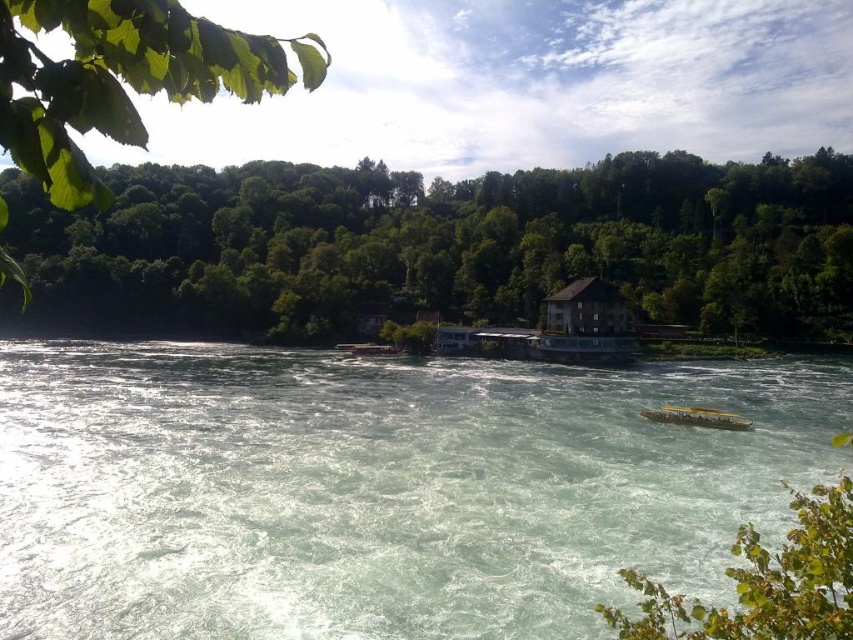
Is white frothy water at center positioned behind green leafy trees at upper center?

No, it is in front of green leafy trees at upper center.

What do you see at coordinates (379, 488) in the screenshot? I see `white frothy water at center` at bounding box center [379, 488].

Image resolution: width=853 pixels, height=640 pixels. I want to click on white frothy water at center, so click(379, 488).

Identify the location of white frothy water at center. This screenshot has width=853, height=640. (379, 488).